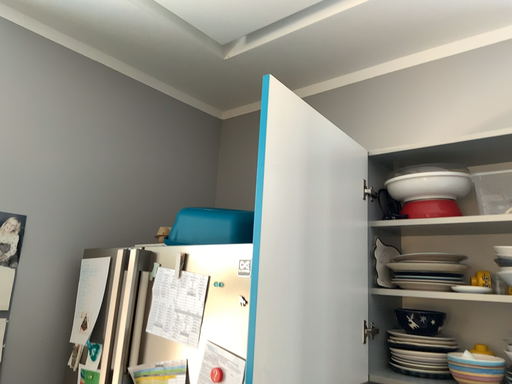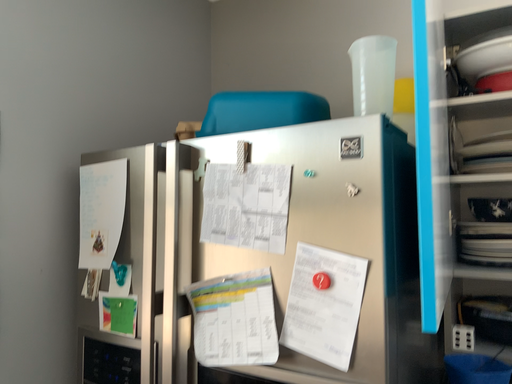
Question: Which way did the camera rotate in the video?

Choices:
 (A) rotated downward
 (B) rotated upward

Answer: (A)